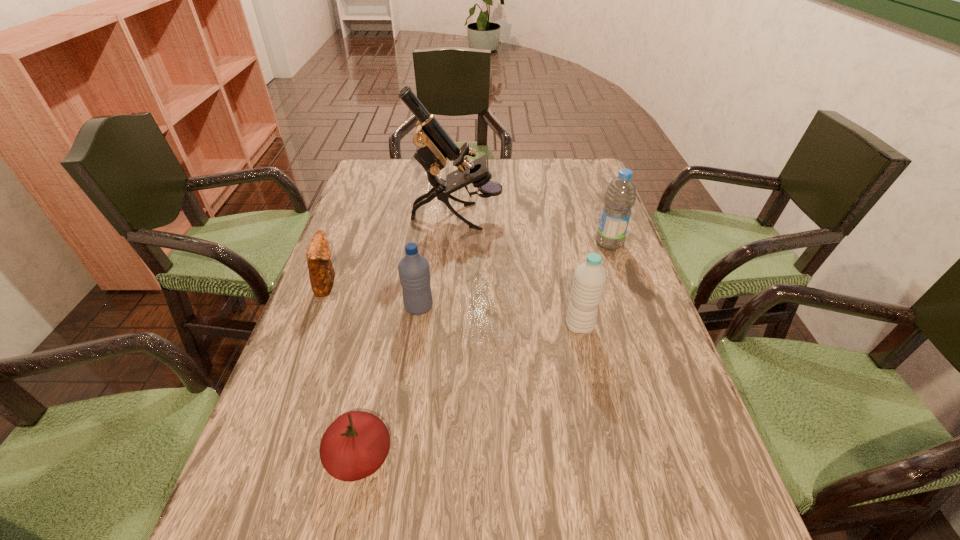
Locate an element on the screen. microscope is located at coordinates (434, 145).

At what (x,y) coordinates should I click in order to perform the action: click on the farthest object. Please return your answer as a coordinate pair (x, y). The image size is (960, 540). Looking at the image, I should click on (434, 145).

Where is `the rightmost water bottle`? the rightmost water bottle is located at coordinates (620, 196).

The image size is (960, 540). Identify the location of the rightmost object. (620, 196).

Identify the location of the second water bottle from right to left. 589,280.

Locate an element on the screen. the leftmost water bottle is located at coordinates (414, 272).

Identify the location of clutch bag. The height and width of the screenshot is (540, 960). (321, 272).

Locate an element on the screen. The height and width of the screenshot is (540, 960). the second shortest object is located at coordinates (321, 272).

You are a GUI agent. You are given a task and a screenshot of the screen. Output one action in this format:
    pyautogui.click(x=<x>, y=<y>)
    Task: Click on the nearest object
    
    Given the screenshot: What is the action you would take?
    pyautogui.click(x=356, y=444)

At what (x,y) coordinates should I click in order to perform the action: click on tomato. Please return your answer as a coordinate pair (x, y). This screenshot has height=540, width=960. Looking at the image, I should click on (356, 444).